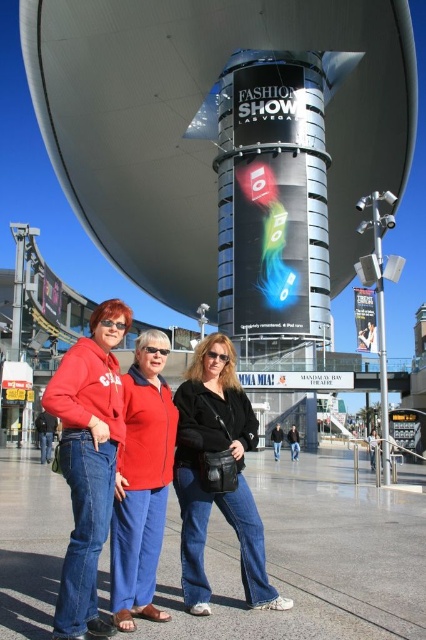
Is matte black jacket at center bigger than matte red jacket at center?

Indeed, matte black jacket at center has a larger size compared to matte red jacket at center.

Which is below, matte black jacket at center or matte red jacket at center?

Positioned lower is matte red jacket at center.

Is point (189, 536) behind point (132, 611)?

Yes.

I want to click on matte black jacket at center, so [212, 480].

Can you confirm if matte red hoodie at center is wider than matte black jacket at center?

Incorrect, matte red hoodie at center's width does not surpass matte black jacket at center's.

This screenshot has width=426, height=640. What do you see at coordinates (88, 461) in the screenshot?
I see `matte red hoodie at center` at bounding box center [88, 461].

Where is `matte red hoodie at center`? matte red hoodie at center is located at coordinates (88, 461).

Is point (80, 580) closer to camera compared to point (137, 380)?

Yes, it is.

Between point (68, 627) and point (152, 392), which one is positioned behind?

Point (152, 392)

Is point (86, 620) farther from camera compared to point (152, 483)?

No.

This screenshot has height=640, width=426. I want to click on matte red hoodie at center, so point(88,461).